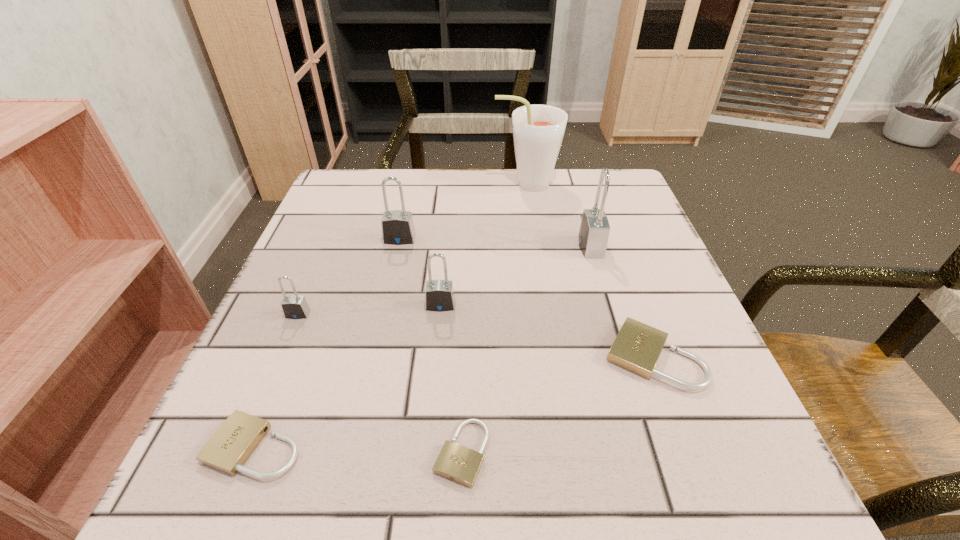
Image resolution: width=960 pixels, height=540 pixels. I want to click on the third shortest padlock, so click(637, 347).

This screenshot has height=540, width=960. I want to click on the farthest beige padlock, so click(637, 347).

At what (x,y) coordinates should I click in order to perform the action: click on the second biggest beige padlock. Please return your answer as a coordinate pair (x, y). The height and width of the screenshot is (540, 960). Looking at the image, I should click on (228, 449).

You are a GUI agent. You are given a task and a screenshot of the screen. Output one action in this format:
    pyautogui.click(x=<x>, y=<y>)
    Task: Click on the second shortest padlock
    
    Given the screenshot: What is the action you would take?
    pyautogui.click(x=228, y=449)

Image resolution: width=960 pixels, height=540 pixels. Identify the location of the shortest object. (455, 462).

This screenshot has height=540, width=960. Identify the location of the second beige padlock from left to right. (455, 462).

Identify the location of free spot located 0.350m on the drink side of the root beer. The height and width of the screenshot is (540, 960). (354, 184).

Identify the location of free location located 0.300m on the drink side of the root beer. (374, 184).

Locate an element on the screen. The height and width of the screenshot is (540, 960). free space located 0.280m on the drink side of the root beer is located at coordinates (382, 184).

Where is `vacant space situated on the shackle of the seventh shortest object`? The width and height of the screenshot is (960, 540). vacant space situated on the shackle of the seventh shortest object is located at coordinates (489, 246).